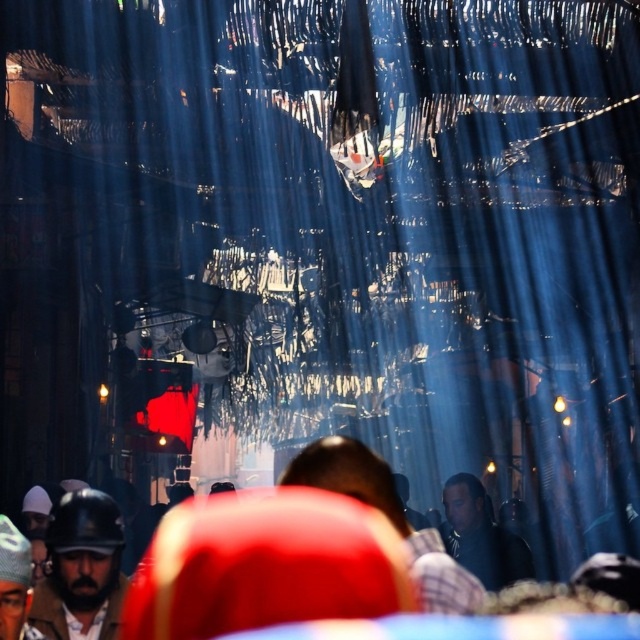
You are standing at the center of the street and see a point marked at coordinates [276,550]. What object is located at that point?

The point at [276,550] marks the red fabric headscarf at center.

You are a photographer trying to capture a portrait of the central figures in this scene. You notice the red fabric headscarf at center and the dark blue shirt at center. Which object should you focus on to ensure it appears larger in your photo?

The red fabric headscarf at center is much taller than the dark blue shirt at center, so focusing on it will make it appear larger in the photo.

You are a photographer trying to capture a candid shot of the two people in the scene wearing a red fabric headscarf at center and a plaid shirt at center. To frame the shot properly, you need to know their positioning. Which of the two is positioned to the left?

The red fabric headscarf at center is to the left of plaid shirt at center, so the person wearing the red fabric headscarf at center is positioned to the left.